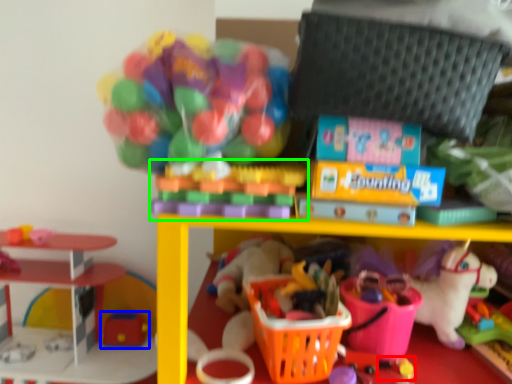
Question: Which is nearer to the toy (highlighted by a red box)? toy (highlighted by a blue box) or toy (highlighted by a green box).

Choices:
 (A) toy
 (B) toy

Answer: (B)